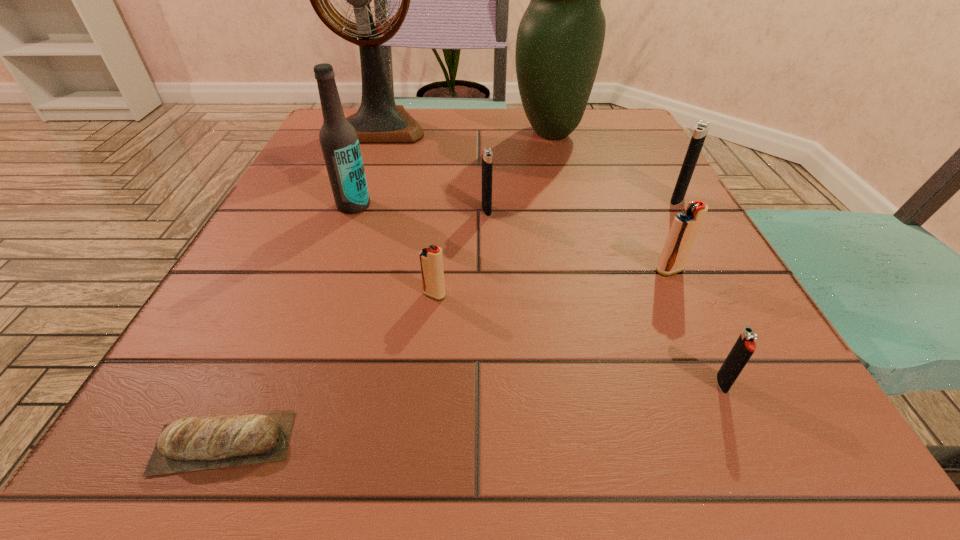
Where is `the tallest object`? This screenshot has height=540, width=960. the tallest object is located at coordinates 378,120.

Identify the location of fan. (378, 120).

Locate an element on the screen. This screenshot has height=540, width=960. green vase is located at coordinates (560, 38).

At what (x,y) coordinates should I click in order to perform the action: click on vase. Please return your answer as a coordinate pair (x, y). Looking at the image, I should click on (560, 38).

Where is `beer bottle`? Image resolution: width=960 pixels, height=540 pixels. beer bottle is located at coordinates (338, 138).

The width and height of the screenshot is (960, 540). Find the location of `the rightmost igniter`. the rightmost igniter is located at coordinates 701,129.

Locate an element on the screen. The height and width of the screenshot is (540, 960). the rightmost object is located at coordinates (701, 129).

Identify the location of the fifth object from right to left. (487, 155).

In order to click on the fourth igniter from right to left in this screenshot , I will do `click(487, 155)`.

Find the location of a particular element. the bigger red igniter is located at coordinates (685, 227).